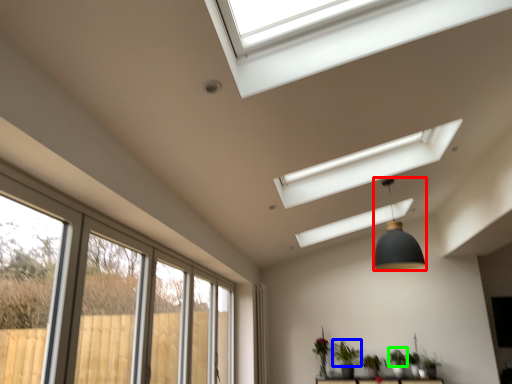
Question: Which is nearer to the light fixture (highlighted by a red box)? plant (highlighted by a blue box) or plant (highlighted by a green box).

Choices:
 (A) plant
 (B) plant

Answer: (A)